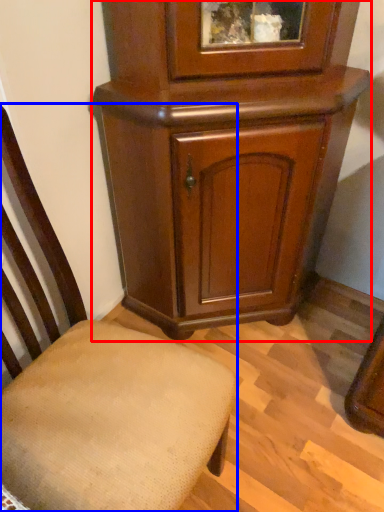
Question: Which object appears farthest to the camera in this image, cupboard (highlighted by a red box) or chair (highlighted by a blue box)?

Choices:
 (A) cupboard
 (B) chair

Answer: (A)